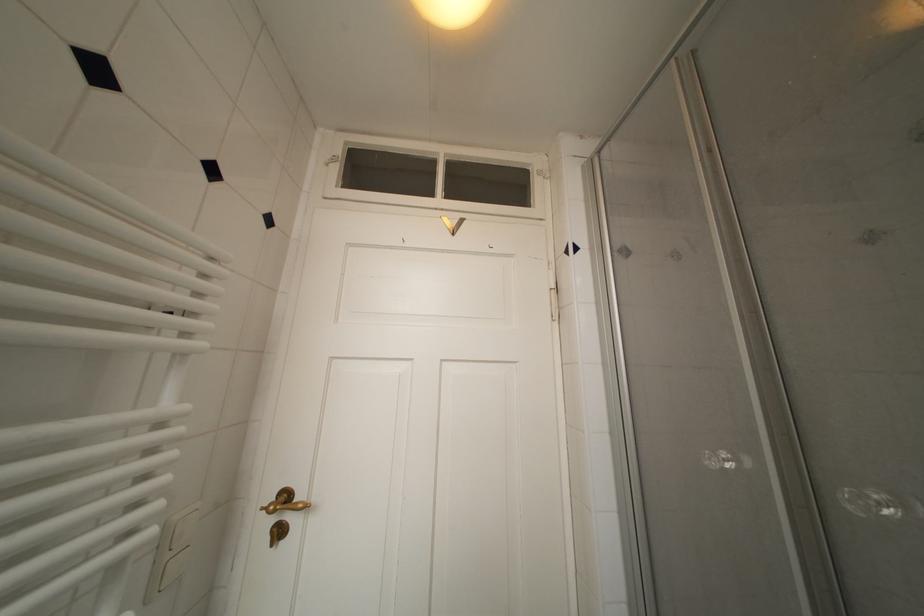
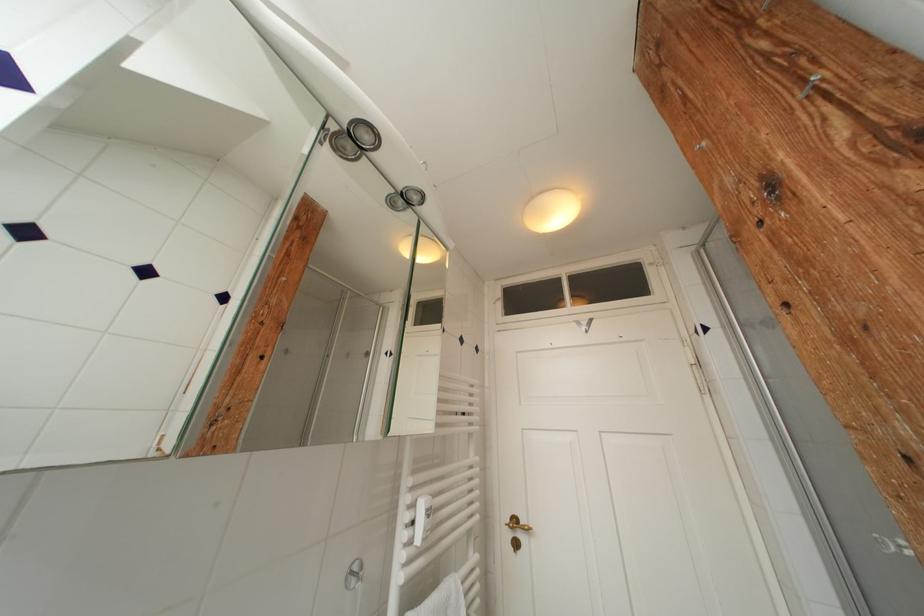
Where in the second image is the point corresponding to point 293,500 from the first image?

(521, 525)